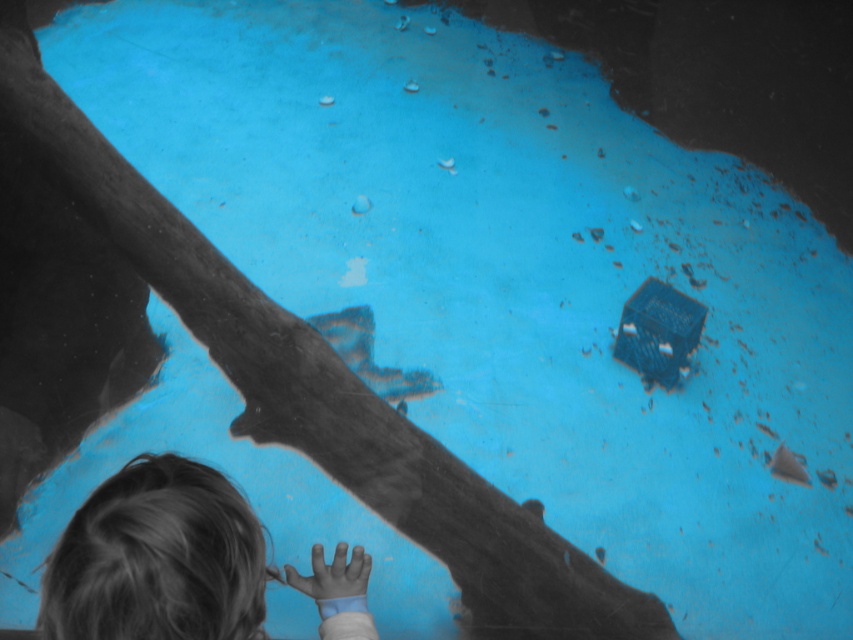
Question: Among these objects, which one is nearest to the camera?

Choices:
 (A) blonde hair at lower left
 (B) smooth skin hand at lower center

Answer: (A)

Question: Which point is closer to the camera?

Choices:
 (A) (322, 582)
 (B) (141, 630)

Answer: (B)

Question: Does blonde hair at lower left have a smaller size compared to smooth skin hand at lower center?

Choices:
 (A) yes
 (B) no

Answer: (B)

Question: Is blonde hair at lower left below smooth skin hand at lower center?

Choices:
 (A) no
 (B) yes

Answer: (A)

Question: Is blonde hair at lower left bigger than smooth skin hand at lower center?

Choices:
 (A) no
 (B) yes

Answer: (B)

Question: Which of the following is the closest to the observer?

Choices:
 (A) blonde hair at lower left
 (B) smooth skin hand at lower center

Answer: (A)